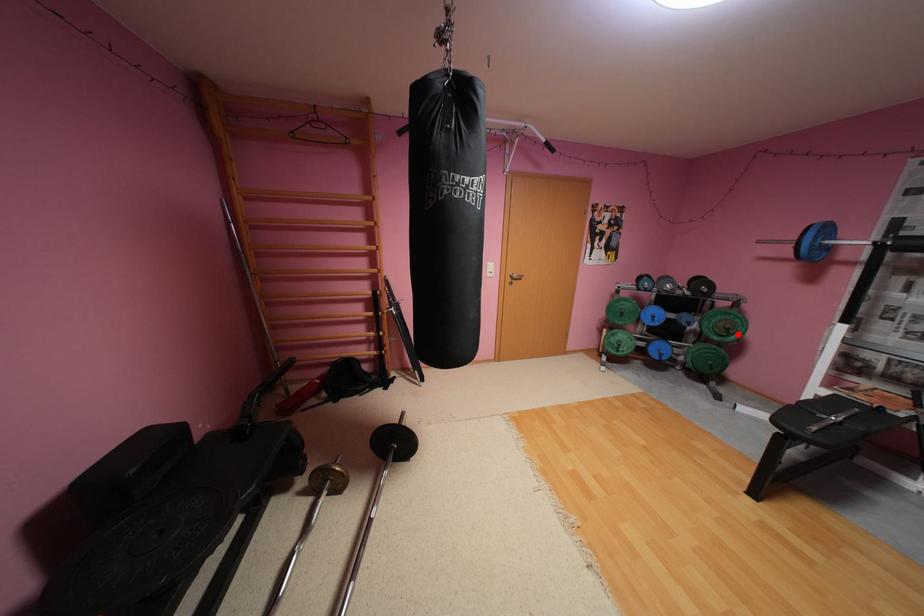
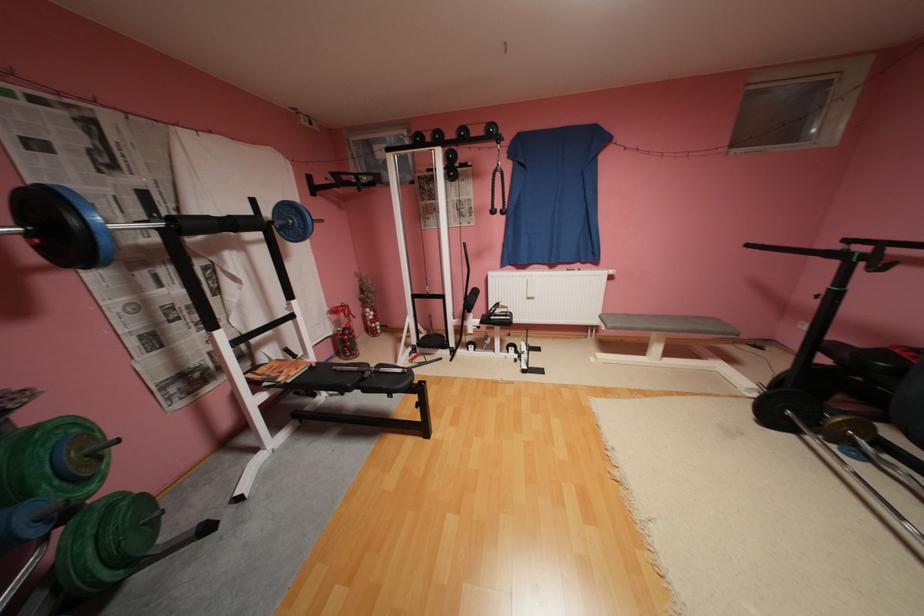
In the second image, find the point that corresponds to the highlighted location in the first image.

(111, 459)